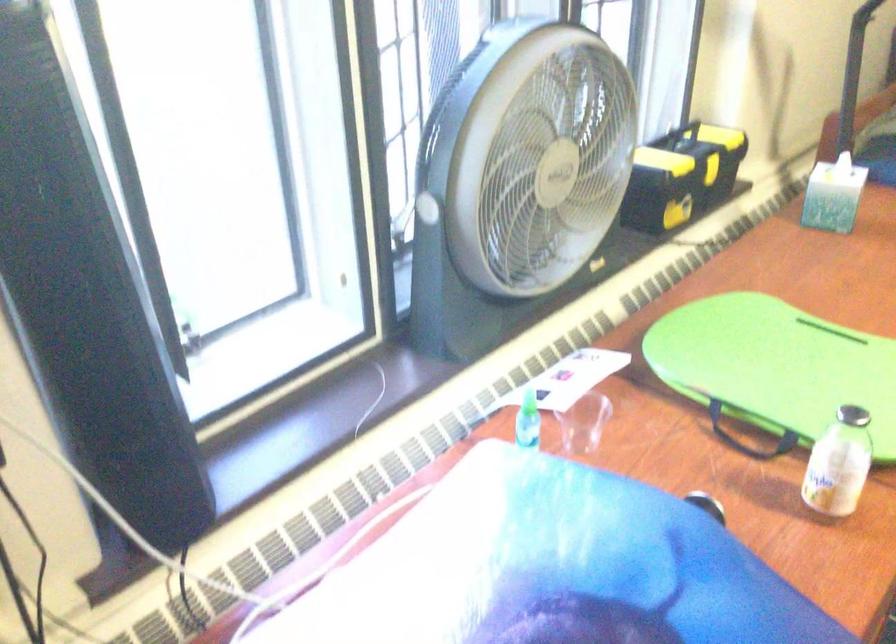
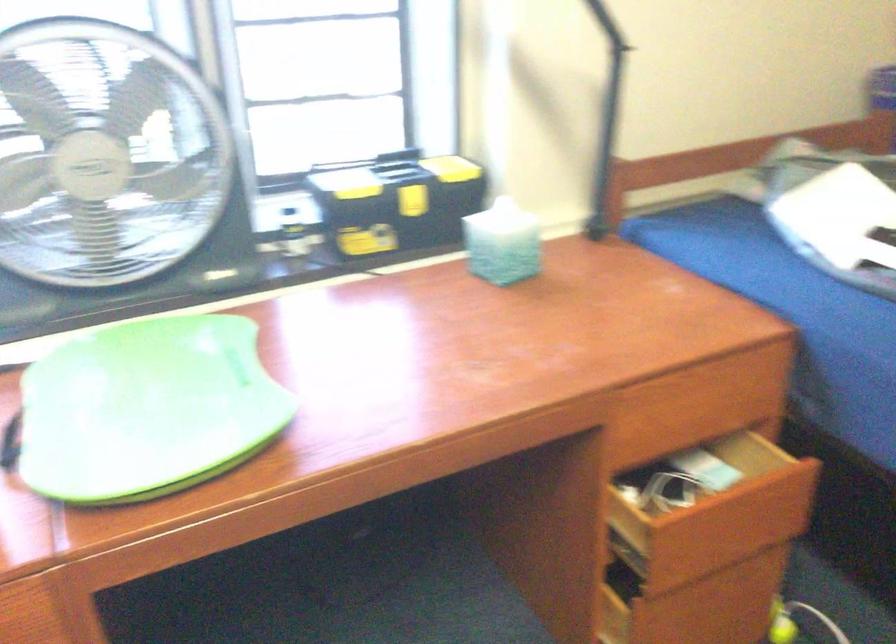
Find the pixel in the second image that matches (x=691, y=164) in the first image.

(401, 185)